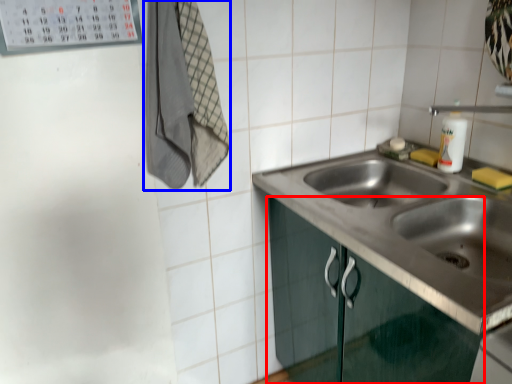
Question: Which point is further to the camera, cabinetry (highlighted by a red box) or laundry (highlighted by a blue box)?

Choices:
 (A) cabinetry
 (B) laundry

Answer: (B)